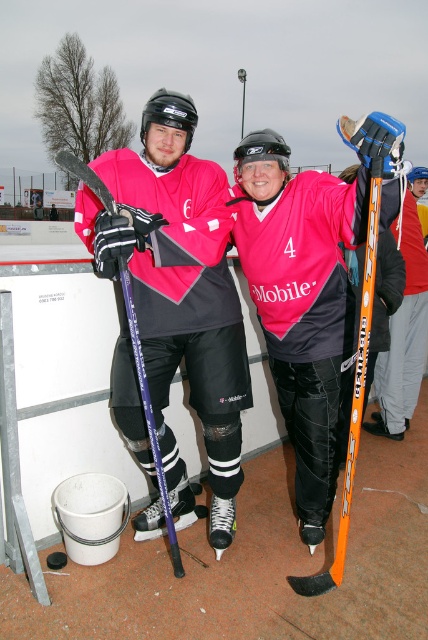
Where is `pink matte hockey jersey at center`? pink matte hockey jersey at center is located at coordinates (273, 273).

The image size is (428, 640). I want to click on pink matte hockey jersey at center, so click(x=273, y=273).

Can you confirm if pink matte hockey jersey at center is positioned below purple glossy hockey stick at left?

Incorrect, pink matte hockey jersey at center is not positioned below purple glossy hockey stick at left.

Does pink matte hockey jersey at center have a lesser height compared to purple glossy hockey stick at left?

No.

You are a GUI agent. You are given a task and a screenshot of the screen. Output one action in this format:
    pyautogui.click(x=<x>, y=<y>)
    Task: Click on the pink matte hockey jersey at center
    The height and width of the screenshot is (640, 428).
    Given the screenshot: What is the action you would take?
    pyautogui.click(x=273, y=273)

Is orange metallic hockey stick at center further to camera compared to purple glossy hockey stick at left?

Yes.

Does orange metallic hockey stick at center have a smaller size compared to purple glossy hockey stick at left?

Incorrect, orange metallic hockey stick at center is not smaller in size than purple glossy hockey stick at left.

Find the location of `orange metallic hockey stick at center`. orange metallic hockey stick at center is located at coordinates (404, 333).